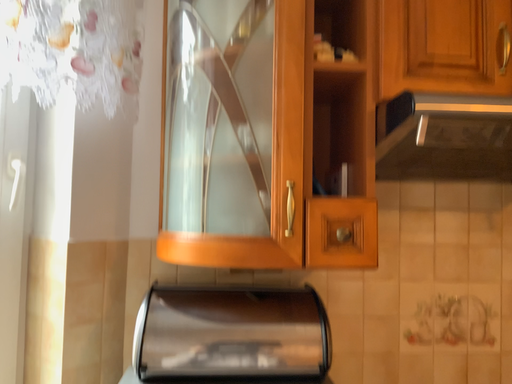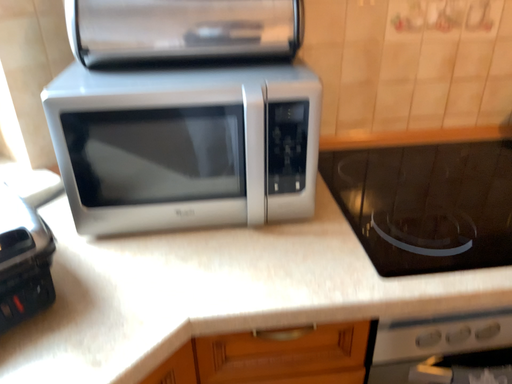
Question: How did the camera likely rotate when shooting the video?

Choices:
 (A) rotated downward
 (B) rotated upward

Answer: (A)